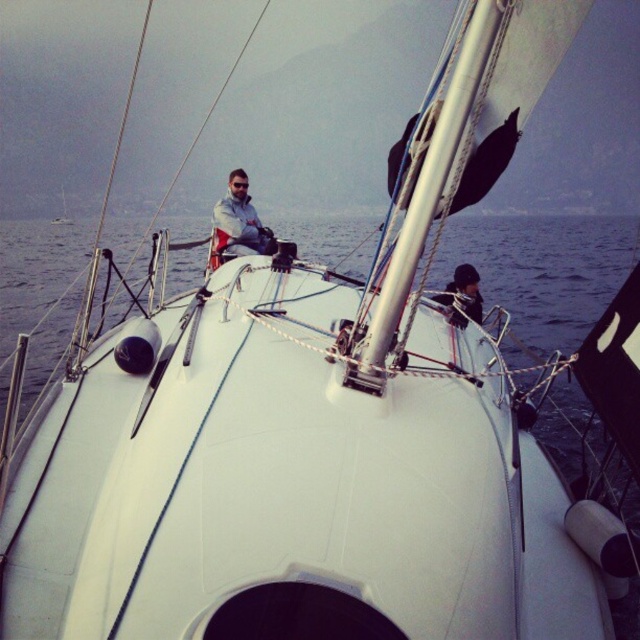
You are a sailor on the deck of the sailboat and need to retrieve both the white matte jacket at center and the black matte jacket at center. Which jacket should you reach for first to avoid moving the other?

The white matte jacket at center is closer to you, so you should reach for it first to avoid disturbing the black matte jacket at center which is further away.

You are a sailor on the deck of the sailboat and need to choose a jacket to wear. Both the white matte jacket at center and the black matte jacket at center are available. Based on their sizes, which jacket would you choose if you prefer a taller jacket?

The white matte jacket at center has a greater height compared to the black matte jacket at center, so you should choose the white matte jacket at center if you prefer a taller jacket.

You are a sailor on the deck of the white matte sailboat at center and need to store the black matte jacket at center. Given that the jacket is smaller than the sailboat, where would be a suitable place to store it?

Since the black matte jacket at center is smaller than the white matte sailboat at center, it can be stored in a compartment or locker on the boat, ensuring it fits securely.